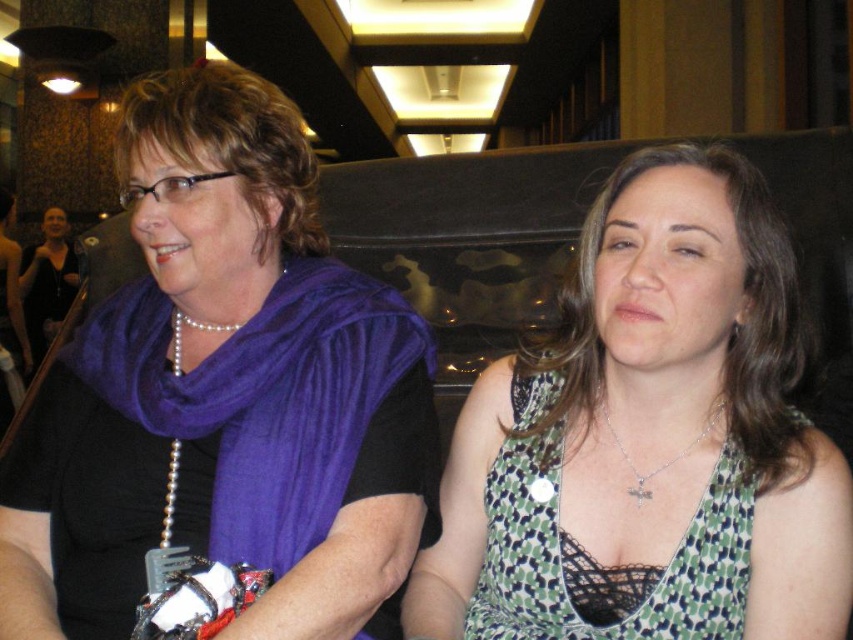
Question: Does purple scarf at left appear over silver metallic necklace at center?

Choices:
 (A) yes
 (B) no

Answer: (A)

Question: Based on their relative distances, which object is nearer to the green printed fabric dress at center?

Choices:
 (A) black fabric dress at left
 (B) silver metallic necklace at center

Answer: (B)

Question: Which point is farther to the camera?

Choices:
 (A) (688, 472)
 (B) (36, 298)
 (C) (737, 593)

Answer: (B)

Question: Does green printed fabric dress at center come behind green dotted fabric dress at center?

Choices:
 (A) yes
 (B) no

Answer: (B)

Question: Which point appears farthest from the camera in this image?

Choices:
 (A) (590, 611)
 (B) (59, 484)
 (C) (635, 467)
 (D) (65, 268)

Answer: (D)

Question: Does green printed fabric dress at center have a greater width compared to silver metallic necklace at center?

Choices:
 (A) no
 (B) yes

Answer: (B)